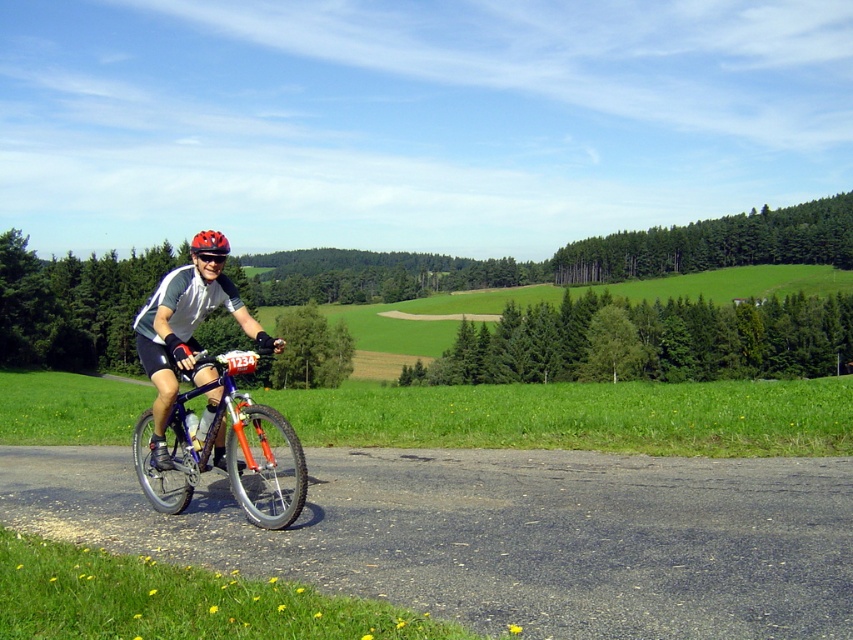
You are a photographer trying to capture the cyclist. You notice the shiny blue frame at center and the orange matte bicycle helmet at upper center in your viewfinder. Which object should you focus on if you want to photograph the taller one?

The orange matte bicycle helmet at upper center is taller than the shiny blue frame at center, so you should focus on the orange matte bicycle helmet at upper center.

You are standing at the point labeled as point (221, 372) and want to throw a ball to someone standing 15 feet away from you. Is the viewer within the throwing distance?

The distance between point (221, 372) and the viewer is 20.24 feet, which is greater than 15 feet. Therefore, the viewer is outside the throwing range.

You are a photographer trying to capture the cyclist. You notice the shiny blue frame at center and the orange matte bicycle helmet at upper center. Which object should you focus on first to ensure it appears sharp in your photo if you want the helmet to be in the background?

The shiny blue frame at center should be focused on first because it is in front of the orange matte bicycle helmet at upper center. By focusing on the closer object, the helmet in the background will still be in focus if the depth of field is sufficient.